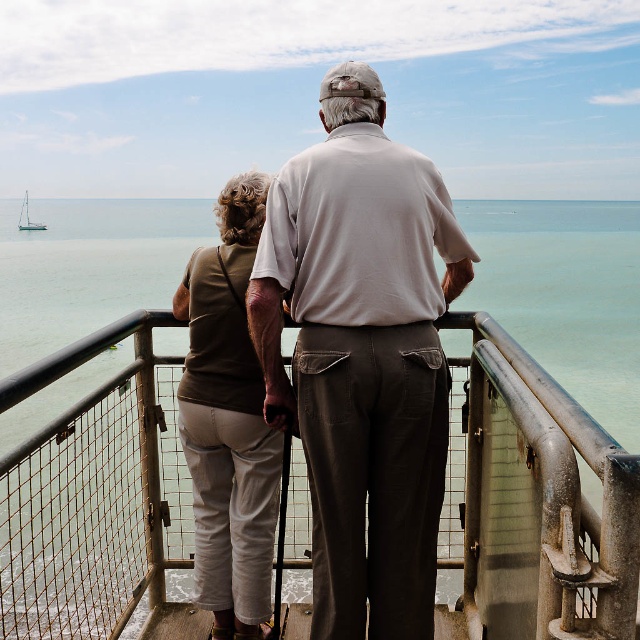
You are standing on the metal railing overlooking the sea and see two points marked on the railing. The first point is at coordinate point(611, 445) and the second point is at coordinate point(35, 227). Which point is closer to you as you face the sea?

Point(611, 445) is in front of point(35, 227), so the point at point(611, 445) is closer to you as you face the sea.

You are a photographer trying to capture a candid shot of the white cotton shirt at center. You have a camera with a 2.5 meter focal length. Can you take the photo without moving closer?

The distance between the white cotton shirt at center and the camera is 2.84 meters. Since the camera has a 2.5 meter focal length, which is shorter than the required distance, you cannot take the photo without moving closer.